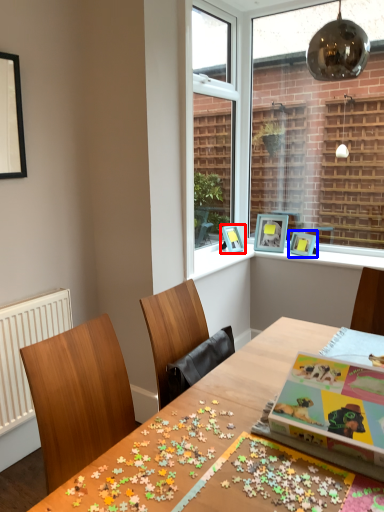
Question: Which object is closer to the camera taking this photo, picture frame (highlighted by a red box) or picture frame (highlighted by a blue box)?

Choices:
 (A) picture frame
 (B) picture frame

Answer: (B)